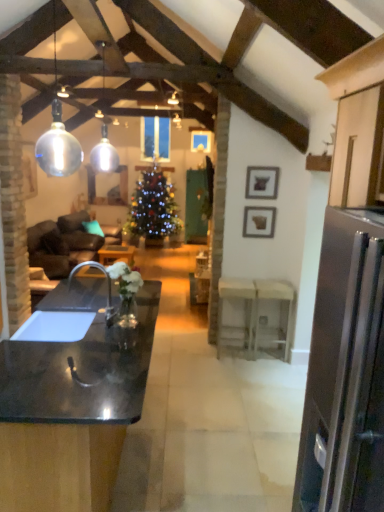
Question: Is matte gray picture frame at upper right, which is the 1th picture frame in bottom-to-top order, smaller than white wood table at center, the first table from the front?

Choices:
 (A) yes
 (B) no

Answer: (A)

Question: Is matte gray picture frame at upper right, which ranks as the second picture frame in top-to-bottom order, not near white wood table at center, the first table from the front?

Choices:
 (A) yes
 (B) no

Answer: (B)

Question: Does matte gray picture frame at upper right, which ranks as the second picture frame in top-to-bottom order, have a lesser width compared to white wood table at center, the first table from the front?

Choices:
 (A) no
 (B) yes

Answer: (B)

Question: From the image's perspective, is matte gray picture frame at upper right, which ranks as the second picture frame in top-to-bottom order, above white wood table at center, the first table from the front?

Choices:
 (A) yes
 (B) no

Answer: (A)

Question: Is matte gray picture frame at upper right, the 2th picture frame when ordered from front to back, to the right of white wood table at center, the first table from the front, from the viewer's perspective?

Choices:
 (A) yes
 (B) no

Answer: (A)

Question: Is glossy black countertop at center bigger or smaller than white glossy table at center, which is the third table from left to right?

Choices:
 (A) small
 (B) big

Answer: (B)

Question: From the image's perspective, is glossy black countertop at center above or below white glossy table at center, which is counted as the 2th table, starting from the front?

Choices:
 (A) below
 (B) above

Answer: (A)

Question: Considering their positions, is glossy black countertop at center located in front of or behind white glossy table at center, which is counted as the 2th table, starting from the front?

Choices:
 (A) front
 (B) behind

Answer: (A)

Question: Considering the positions of glossy black countertop at center and white glossy table at center, which is counted as the 2th table, starting from the front, in the image, is glossy black countertop at center wider or thinner than white glossy table at center, which is counted as the 2th table, starting from the front,?

Choices:
 (A) thin
 (B) wide

Answer: (B)

Question: Based on their sizes in the image, would you say white glossy table at center, which is counted as the 2th table, starting from the front, is bigger or smaller than black matte sink at lower left?

Choices:
 (A) big
 (B) small

Answer: (B)

Question: In terms of width, does white glossy table at center, which is counted as the 2th table, starting from the front, look wider or thinner when compared to black matte sink at lower left?

Choices:
 (A) wide
 (B) thin

Answer: (B)

Question: Is white glossy table at center, positioned as the first table in right-to-left order, taller or shorter than black matte sink at lower left?

Choices:
 (A) short
 (B) tall

Answer: (B)

Question: Relative to black matte sink at lower left, is white glossy table at center, positioned as the first table in right-to-left order, in front or behind?

Choices:
 (A) front
 (B) behind

Answer: (B)

Question: Is shiny green christmas tree at center bigger or smaller than glossy black countertop at center?

Choices:
 (A) big
 (B) small

Answer: (A)

Question: From the image's perspective, is shiny green christmas tree at center located above or below glossy black countertop at center?

Choices:
 (A) above
 (B) below

Answer: (A)